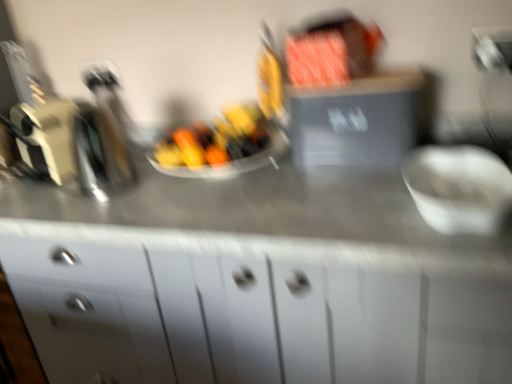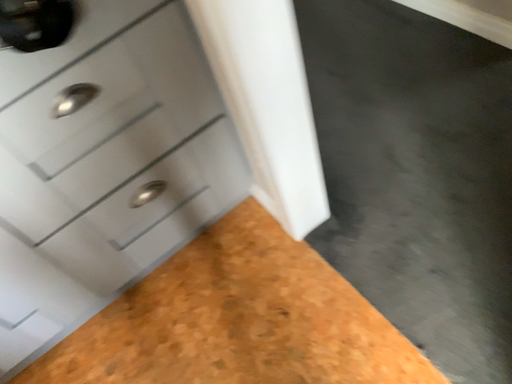
Question: How did the camera likely rotate when shooting the video?

Choices:
 (A) rotated right
 (B) rotated left

Answer: (A)